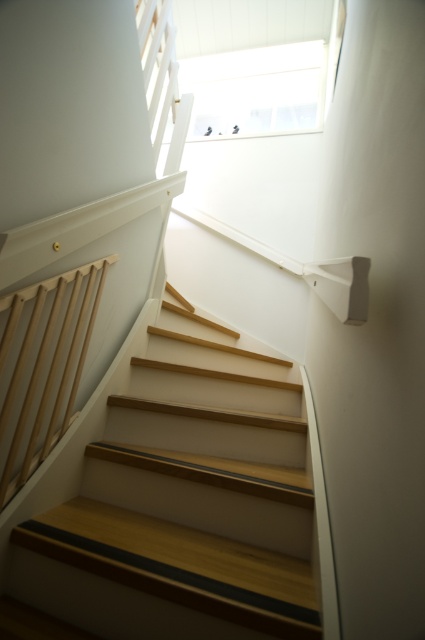
Question: Does wooden stairs at center appear under natural wood railing at left?

Choices:
 (A) no
 (B) yes

Answer: (B)

Question: Does wooden stairs at center lie in front of natural wood railing at left?

Choices:
 (A) yes
 (B) no

Answer: (A)

Question: Observing the image, what is the correct spatial positioning of wooden stairs at center in reference to natural wood railing at left?

Choices:
 (A) left
 (B) right

Answer: (B)

Question: Which point is farther to the camera?

Choices:
 (A) (107, 429)
 (B) (62, 307)

Answer: (A)

Question: Which of the following is the farthest from the observer?

Choices:
 (A) wooden stairs at center
 (B) natural wood railing at left

Answer: (B)

Question: Which of the following is the farthest from the observer?

Choices:
 (A) (3, 385)
 (B) (198, 426)

Answer: (B)